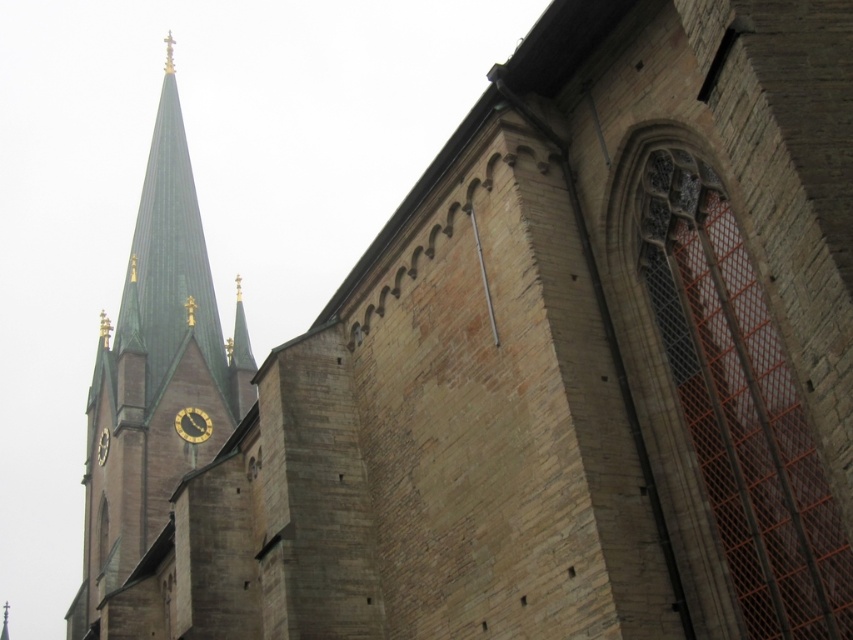
Who is shorter, green slate spire at upper left or gold metallic clock at center?

Standing shorter between the two is gold metallic clock at center.

Where is `green slate spire at upper left`? The image size is (853, 640). green slate spire at upper left is located at coordinates (154, 394).

You are a GUI agent. You are given a task and a screenshot of the screen. Output one action in this format:
    pyautogui.click(x=<x>, y=<y>)
    Task: Click on the green slate spire at upper left
    The width and height of the screenshot is (853, 640).
    Given the screenshot: What is the action you would take?
    pyautogui.click(x=154, y=394)

Can you confirm if gold metallic clock at center is positioned to the right of gold metallic clock at center-left?

Yes, gold metallic clock at center is to the right of gold metallic clock at center-left.

Is gold metallic clock at center further to camera compared to gold metallic clock at center-left?

No.

Locate an element on the screen. Image resolution: width=853 pixels, height=640 pixels. gold metallic clock at center is located at coordinates (192, 424).

Identify the location of gold metallic clock at center. The image size is (853, 640). (192, 424).

Looking at this image, which of these two, green slate spire at upper left or gold metallic clock at center-left, stands taller?

Standing taller between the two is green slate spire at upper left.

Does green slate spire at upper left have a greater height compared to gold metallic clock at center-left?

Yes, green slate spire at upper left is taller than gold metallic clock at center-left.

Which is behind, point (126, 531) or point (100, 444)?

Positioned behind is point (100, 444).

Where is `green slate spire at upper left`? The image size is (853, 640). green slate spire at upper left is located at coordinates (154, 394).